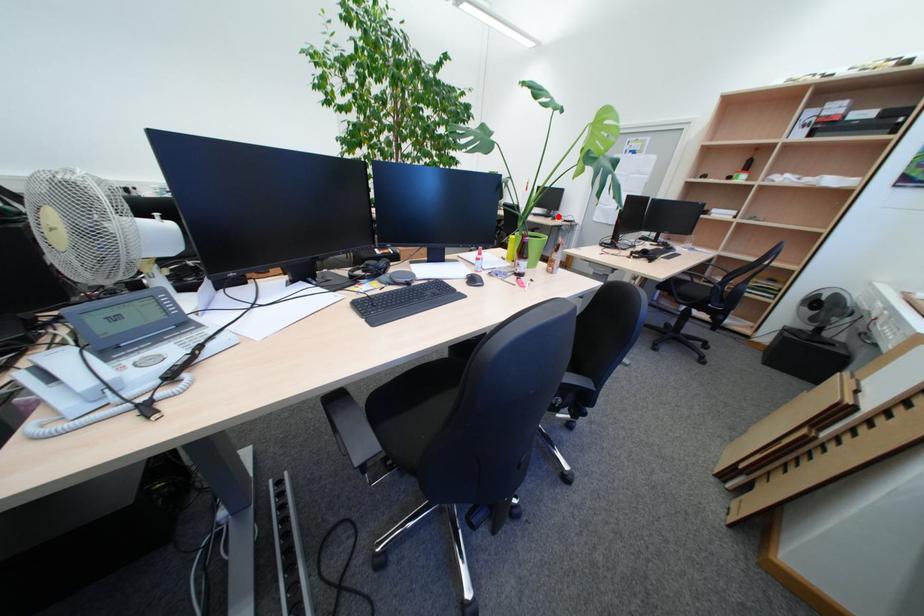
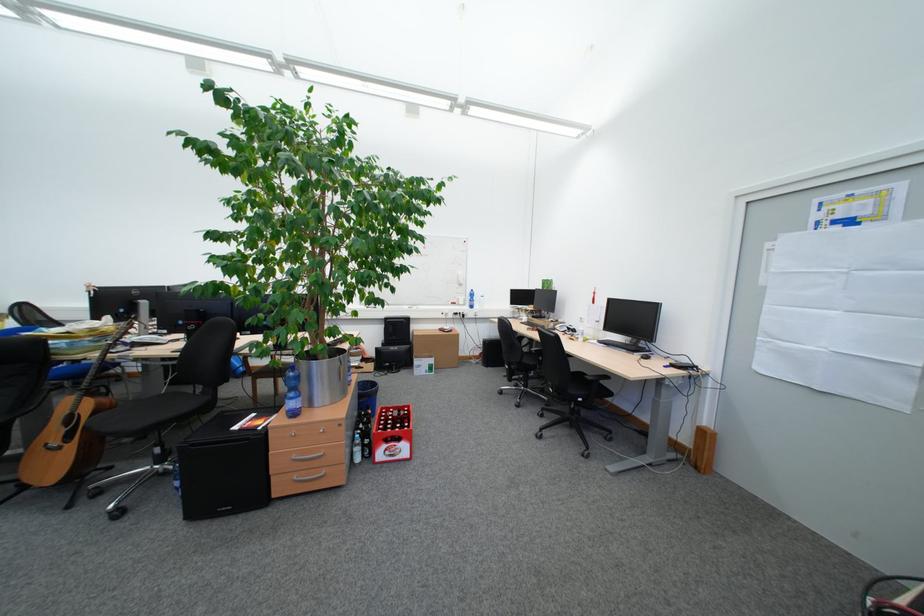
Question: I am providing you with two images of the same scene from different viewpoints. A red point is shown in image1. For the corresponding object point in image2, is it positioned nearer or farther from the camera?

Choices:
 (A) Nearer
 (B) Farther

Answer: (A)